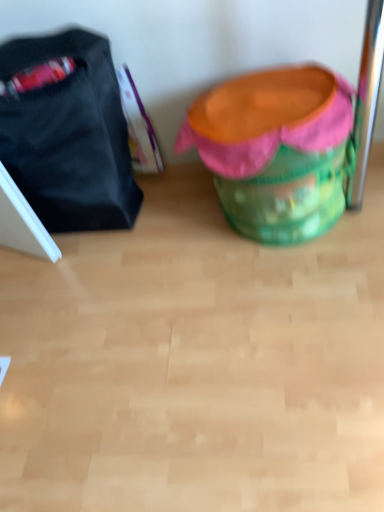
Question: Is the position of green fabric bean bag chair at center less distant than that of matte black bag at left?

Choices:
 (A) no
 (B) yes

Answer: (B)

Question: Is green fabric bean bag chair at center to the right of matte black bag at left from the viewer's perspective?

Choices:
 (A) no
 (B) yes

Answer: (B)

Question: From a real-world perspective, is green fabric bean bag chair at center located higher than matte black bag at left?

Choices:
 (A) no
 (B) yes

Answer: (A)

Question: From a real-world perspective, is green fabric bean bag chair at center below matte black bag at left?

Choices:
 (A) no
 (B) yes

Answer: (B)

Question: Is green fabric bean bag chair at center oriented away from matte black bag at left?

Choices:
 (A) yes
 (B) no

Answer: (B)

Question: Are green fabric bean bag chair at center and matte black bag at left located far from each other?

Choices:
 (A) yes
 (B) no

Answer: (B)

Question: Is matte black bag at left with green fabric bean bag chair at center?

Choices:
 (A) yes
 (B) no

Answer: (B)

Question: Is matte black bag at left oriented towards green fabric bean bag chair at center?

Choices:
 (A) yes
 (B) no

Answer: (B)

Question: Does matte black bag at left have a smaller size compared to green fabric bean bag chair at center?

Choices:
 (A) no
 (B) yes

Answer: (B)

Question: Is matte black bag at left taller than green fabric bean bag chair at center?

Choices:
 (A) no
 (B) yes

Answer: (B)

Question: Can you confirm if matte black bag at left is shorter than green fabric bean bag chair at center?

Choices:
 (A) yes
 (B) no

Answer: (B)

Question: Does matte black bag at left lie behind green fabric bean bag chair at center?

Choices:
 (A) yes
 (B) no

Answer: (A)

Question: Is green fabric bean bag chair at center situated inside matte black bag at left or outside?

Choices:
 (A) outside
 (B) inside

Answer: (A)